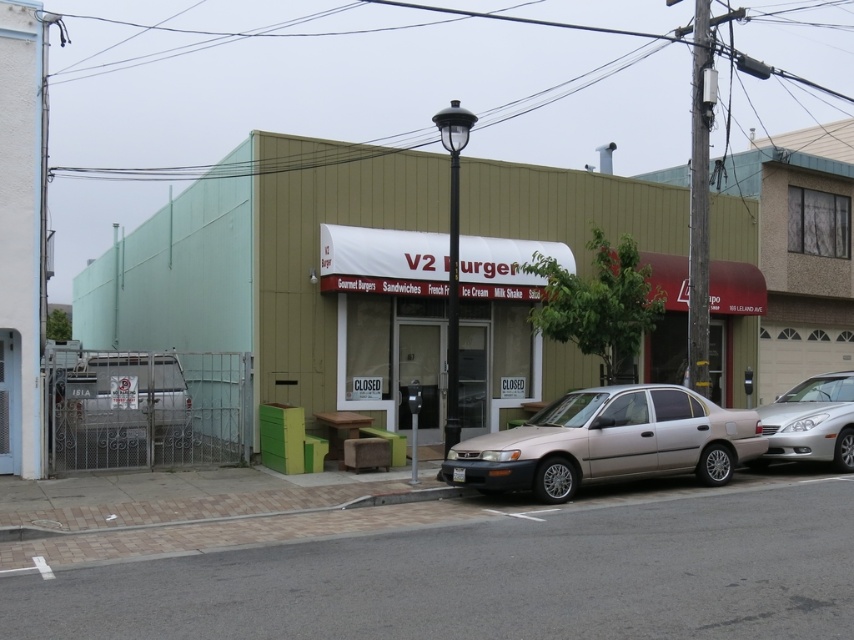
From the picture: Is metallic silver van at lower left shorter than silver metallic sedan at right?

In fact, metallic silver van at lower left may be taller than silver metallic sedan at right.

Measure the distance from metallic silver van at lower left to silver metallic sedan at right.

metallic silver van at lower left and silver metallic sedan at right are 9.35 meters apart from each other.

Between point (153, 387) and point (776, 404), which one is positioned in front?

Point (153, 387)

The height and width of the screenshot is (640, 854). I want to click on metallic silver van at lower left, so click(121, 401).

This screenshot has height=640, width=854. What do you see at coordinates (607, 442) in the screenshot?
I see `satin beige sedan at center` at bounding box center [607, 442].

Is point (563, 397) positioned before point (806, 392)?

Yes, point (563, 397) is in front of point (806, 392).

Does point (513, 442) come behind point (828, 460)?

No, it is not.

This screenshot has height=640, width=854. In order to click on satin beige sedan at center in this screenshot , I will do `click(607, 442)`.

Can you confirm if beige textured building at center is shorter than silver metallic sedan at right?

In fact, beige textured building at center may be taller than silver metallic sedan at right.

In order to click on beige textured building at center in this screenshot , I will do `click(293, 284)`.